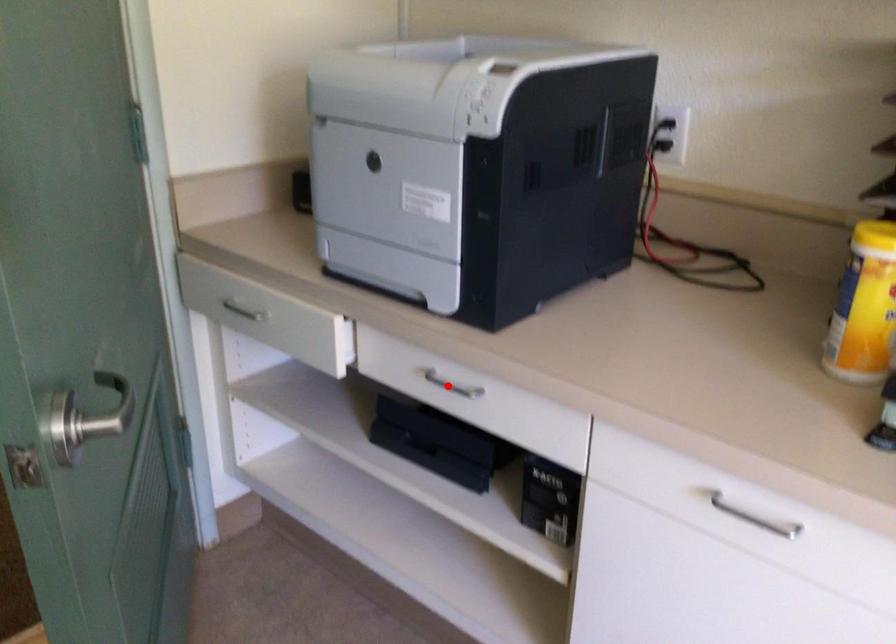
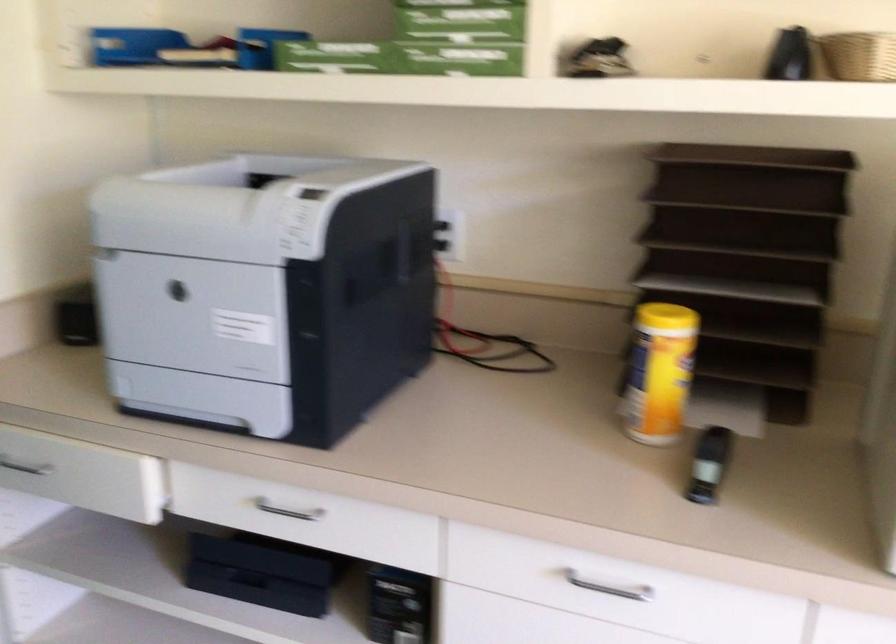
Where in the second image is the point corresponding to the highlighted location from the first image?

(287, 509)